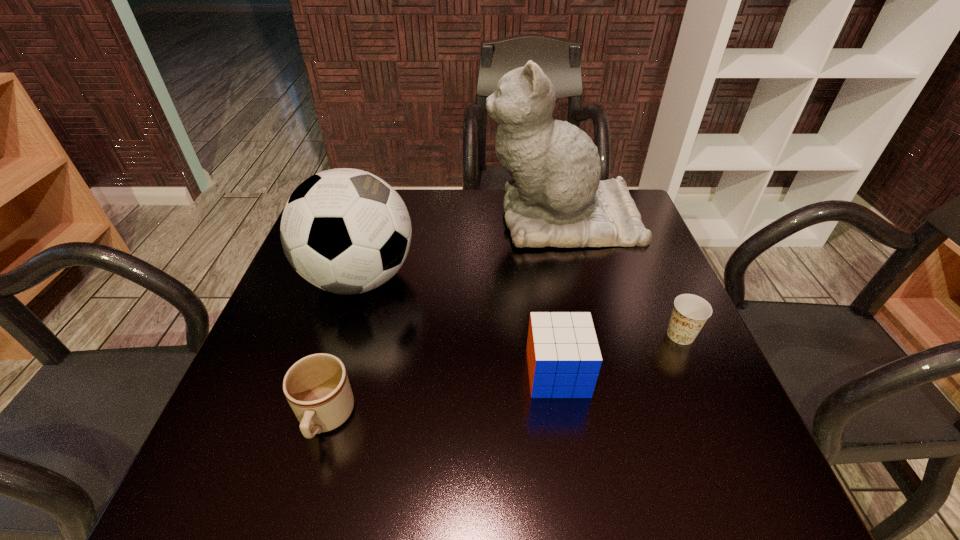
The height and width of the screenshot is (540, 960). What are the coordinates of `free space that satisfies the following two spatial constraints: 1. on the front-facing side of the tallest object; 2. on the front side of the cube` in the screenshot? It's located at (600, 373).

Identify the location of free location that satisfies the following two spatial constraints: 1. on the main logo of the fourth shortest object; 2. on the right side of the cube. This screenshot has width=960, height=540. (331, 373).

The image size is (960, 540). I want to click on vacant area in the image that satisfies the following two spatial constraints: 1. on the front-facing side of the third farthest object; 2. on the left side of the tallest object, so click(x=590, y=335).